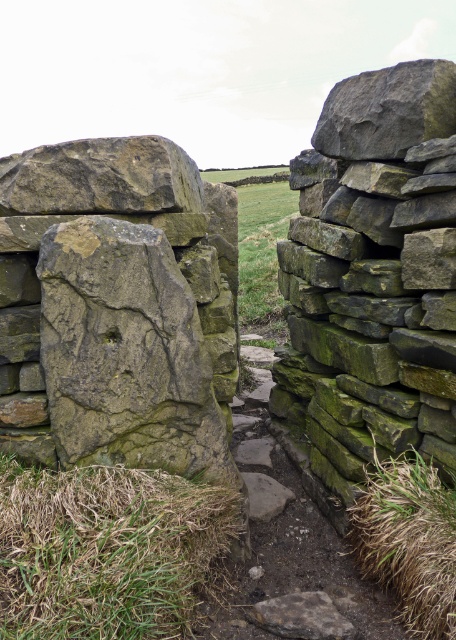
You are a gardener who needs to mow the green grassy hay at lower left and green grassy hay at lower right. Which area requires more time to mow based on their sizes?

The green grassy hay at lower left might be wider than green grassy hay at lower right, so it likely requires more time to mow.

You are standing at the center of the pathway and want to move towards the green grassy hay at lower left. Which direction should you walk to reach it?

You should walk towards the lower left direction to reach the green grassy hay at lower left, as it is located at point (107, 550).